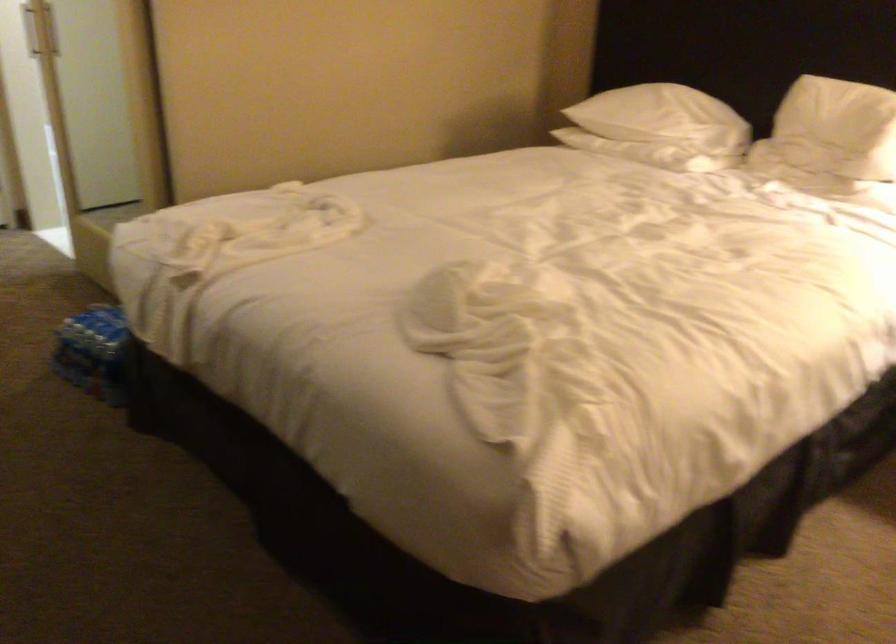
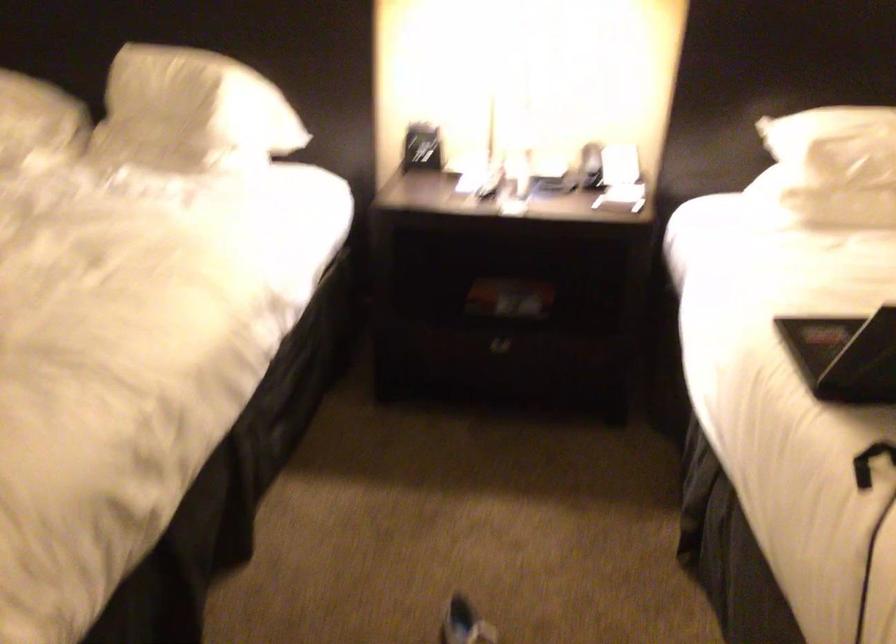
Question: The first image is from the beginning of the video and the second image is from the end. How did the camera likely rotate when shooting the video?

Choices:
 (A) Left
 (B) Right
 (C) Up
 (D) Down

Answer: (B)